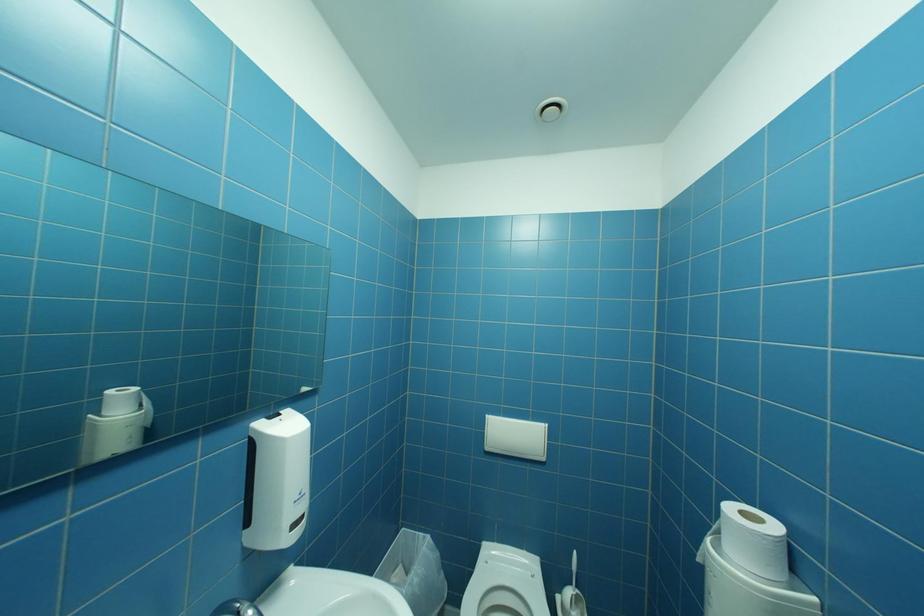
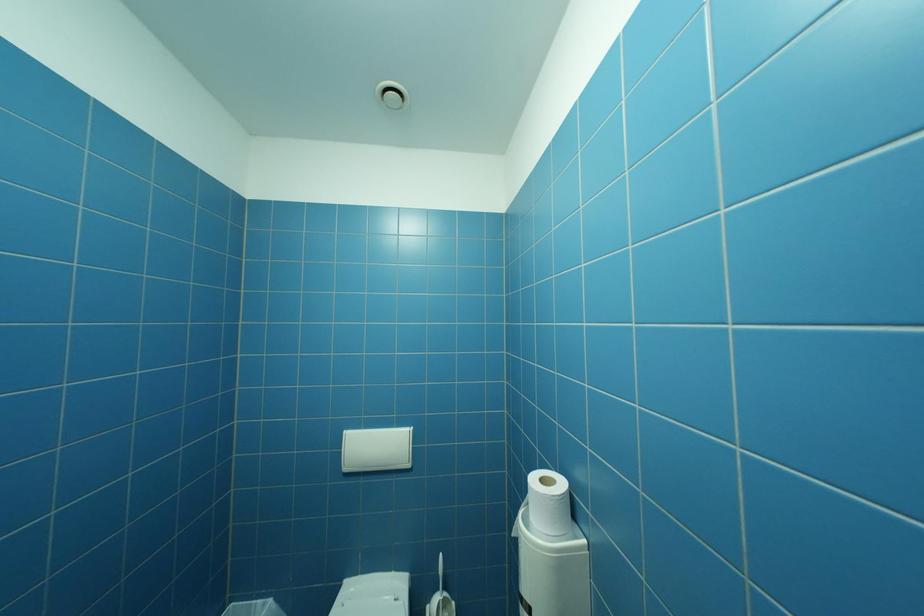
Question: The camera is either moving clockwise (left) or counter-clockwise (right) around the object. The first image is from the beginning of the video and the second image is from the end. Is the camera moving left or right when shooting the video?

Choices:
 (A) Left
 (B) Right

Answer: (A)